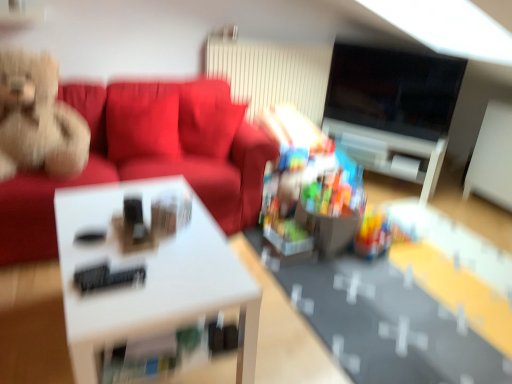
Question: Can you confirm if suede-like red couch at upper left is positioned to the left of translucent plastic toy at center, the second toy in the top-to-bottom sequence?

Choices:
 (A) no
 (B) yes

Answer: (B)

Question: Can you confirm if suede-like red couch at upper left is shorter than translucent plastic toy at center, which is counted as the first toy, starting from the bottom?

Choices:
 (A) no
 (B) yes

Answer: (A)

Question: Is suede-like red couch at upper left completely or partially outside of translucent plastic toy at center, the 2th toy from the left?

Choices:
 (A) yes
 (B) no

Answer: (A)

Question: From the image's perspective, does suede-like red couch at upper left appear lower than translucent plastic toy at center, the second toy in the top-to-bottom sequence?

Choices:
 (A) yes
 (B) no

Answer: (B)

Question: Is suede-like red couch at upper left directly adjacent to translucent plastic toy at center, which is counted as the first toy, starting from the bottom?

Choices:
 (A) yes
 (B) no

Answer: (B)

Question: Is suede-like red couch at upper left at the right side of translucent plastic toy at center, the 2th toy from the left?

Choices:
 (A) yes
 (B) no

Answer: (B)

Question: Is white glossy table at center smaller than black glossy tv at upper right?

Choices:
 (A) yes
 (B) no

Answer: (B)

Question: From a real-world perspective, is white glossy table at center located higher than black glossy tv at upper right?

Choices:
 (A) no
 (B) yes

Answer: (A)

Question: Considering the relative sizes of white glossy table at center and black glossy tv at upper right in the image provided, is white glossy table at center shorter than black glossy tv at upper right?

Choices:
 (A) no
 (B) yes

Answer: (B)

Question: Could you tell me if white glossy table at center is turned towards black glossy tv at upper right?

Choices:
 (A) yes
 (B) no

Answer: (B)

Question: Is white glossy table at center looking in the opposite direction of black glossy tv at upper right?

Choices:
 (A) no
 (B) yes

Answer: (A)

Question: Does white glossy table at center have a greater width compared to black glossy tv at upper right?

Choices:
 (A) yes
 (B) no

Answer: (A)

Question: Considering the relative positions of white glossy table at center and fluffy beige teddy bear on the left, placed as the 1th toy when sorted from left to right, in the image provided, is white glossy table at center to the right of fluffy beige teddy bear on the left, placed as the 1th toy when sorted from left to right, from the viewer's perspective?

Choices:
 (A) no
 (B) yes

Answer: (B)